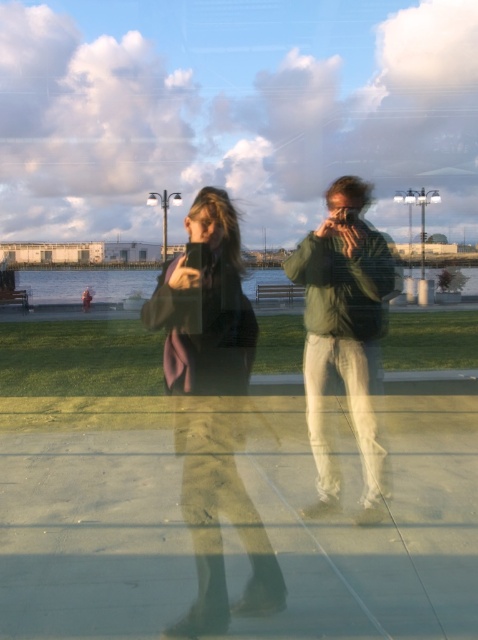
Question: Is matte black jacket at center positioned before green matte jacket at center?

Choices:
 (A) no
 (B) yes

Answer: (B)

Question: Is matte black jacket at center above green matte jacket at center?

Choices:
 (A) yes
 (B) no

Answer: (B)

Question: Which of the following is the closest to the observer?

Choices:
 (A) (329, 326)
 (B) (237, 476)

Answer: (A)

Question: Is matte black jacket at center further to the viewer compared to green matte jacket at center?

Choices:
 (A) yes
 (B) no

Answer: (B)

Question: Which object appears closest to the camera in this image?

Choices:
 (A) matte black jacket at center
 (B) green matte jacket at center

Answer: (A)